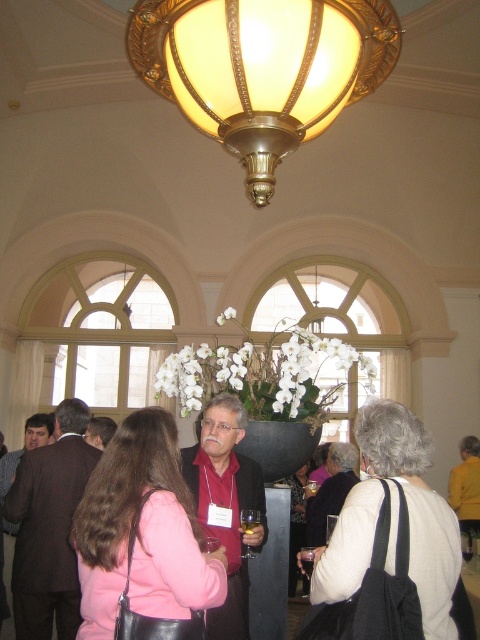
You are a photographer positioned at the back of the room. You want to take a photo of the matte black suit at center and the clear glass wine glass at center. Which object will appear closer to the camera in the photo?

The matte black suit at center will appear closer to the camera in the photo because it is positioned further to the viewer than the clear glass wine glass at center.

You are a photographer at the event and need to ensure both the white matte jacket at center and the matte black suit at center are clearly visible in your photo. Given their sizes, which one might you need to position closer to the camera to maintain clarity?

The white matte jacket at center is larger than the matte black suit at center, so positioning the matte black suit at center closer to the camera would help maintain clarity as it is smaller and might need to be emphasized.

You are at a formal event and see a white matte jacket at center and a pink fabric purse at center. Which object is nearer to you?

The white matte jacket at center is closer to the viewer than the pink fabric purse at center.